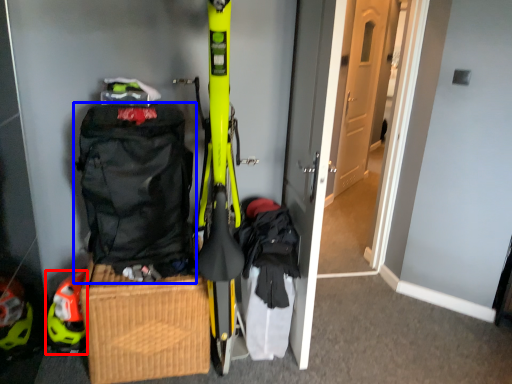
Question: Among these objects, which one is nearest to the camera, helmet (highlighted by a red box) or backpack (highlighted by a blue box)?

Choices:
 (A) helmet
 (B) backpack

Answer: (B)